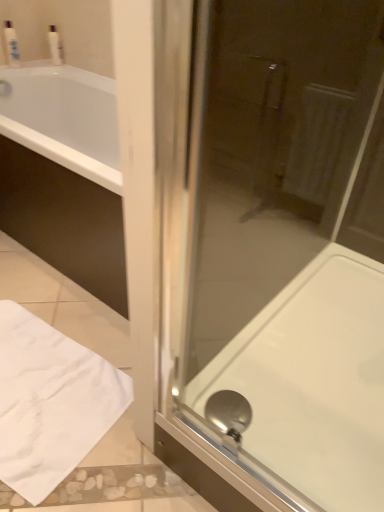
The height and width of the screenshot is (512, 384). What do you see at coordinates (273, 252) in the screenshot?
I see `transparent glass shower door at center` at bounding box center [273, 252].

What is the approximate height of white glossy bath at center?

It is 9.79 inches.

What is the approximate width of white plastic bottle at upper left, the first toiletry viewed from the left?

white plastic bottle at upper left, the first toiletry viewed from the left, is 2.85 inches wide.

I want to click on white plastic bottle at upper left, the first toiletry viewed from the left, so click(x=11, y=44).

At what (x,y) coordinates should I click in order to perform the action: click on white fabric towel at lower left. Please return your answer as a coordinate pair (x, y). The width and height of the screenshot is (384, 512). Looking at the image, I should click on (50, 402).

Is white plastic bottle at upper left, the first toiletry viewed from the left, wider or thinner than white glossy bath at center?

In the image, white plastic bottle at upper left, the first toiletry viewed from the left, appears to be more narrow than white glossy bath at center.

Can you tell me how much white plastic bottle at upper left, the first toiletry viewed from the left, and white glossy bath at center differ in facing direction?

white plastic bottle at upper left, the first toiletry viewed from the left, and white glossy bath at center are facing 90.8 degrees away from each other.

How distant is white plastic bottle at upper left, which appears as the second toiletry when viewed from the right, from white glossy bath at center?

A distance of 1.99 meters exists between white plastic bottle at upper left, which appears as the second toiletry when viewed from the right, and white glossy bath at center.

The width and height of the screenshot is (384, 512). I want to click on the 2nd toiletry counting from the left of the white glossy bath at center, so click(11, 44).

Consider the image. Is white fabric towel at lower left closer to the viewer compared to transparent glass shower door at center?

No, it is behind transparent glass shower door at center.

Is white fabric towel at lower left oriented away from transparent glass shower door at center?

No, white fabric towel at lower left's orientation is not away from transparent glass shower door at center.

From a real-world perspective, is white fabric towel at lower left below transparent glass shower door at center?

Yes, from a real-world perspective, white fabric towel at lower left is below transparent glass shower door at center.

From the image's perspective, relative to transparent glass shower door at center, is white fabric towel at lower left above or below?

white fabric towel at lower left is situated lower than transparent glass shower door at center in the image.

This screenshot has width=384, height=512. In order to click on sheet that appears on the right of white plastic bottle at upper left, which appears as the second toiletry when viewed from the right in this screenshot , I will do `click(50, 402)`.

From the image's perspective, is white plastic bottle at upper left, which appears as the second toiletry when viewed from the right, positioned above or below white fabric towel at lower left?

From the image's perspective, white plastic bottle at upper left, which appears as the second toiletry when viewed from the right, appears above white fabric towel at lower left.

Between white plastic bottle at upper left, which appears as the second toiletry when viewed from the right, and white fabric towel at lower left, which one has smaller size?

Smaller between the two is white plastic bottle at upper left, which appears as the second toiletry when viewed from the right.

In terms of height, does white fabric towel at lower left look taller or shorter compared to white glossy bath at center?

white fabric towel at lower left is shorter than white glossy bath at center.

Is white fabric towel at lower left oriented towards white glossy bath at center?

No, white fabric towel at lower left is not facing towards white glossy bath at center.

From the picture: How much distance is there between white fabric towel at lower left and white glossy bath at center?

white fabric towel at lower left is 20.99 inches from white glossy bath at center.

Is white fabric towel at lower left next to white glossy bath at center?

white fabric towel at lower left and white glossy bath at center are clearly separated.

In order to click on toiletry below the white plastic bottle at upper left, the first toiletry viewed from the left (from a real-world perspective) in this screenshot , I will do `click(55, 46)`.

Would you consider white plastic bottle at upper left, the first toiletry viewed from the left, to be distant from white glossy bottle at upper left, the first toiletry viewed from the right?

No, white plastic bottle at upper left, the first toiletry viewed from the left, is not far away from white glossy bottle at upper left, the first toiletry viewed from the right.

In terms of width, does white plastic bottle at upper left, the first toiletry viewed from the left, look wider or thinner when compared to white glossy bottle at upper left, the 2th toiletry positioned from the left?

Clearly, white plastic bottle at upper left, the first toiletry viewed from the left, has more width compared to white glossy bottle at upper left, the 2th toiletry positioned from the left.

Is transparent glass shower door at center to the left of white fabric towel at lower left from the viewer's perspective?

No.

From a real-world perspective, which is physically above, transparent glass shower door at center or white fabric towel at lower left?

In real-world perspective, transparent glass shower door at center is above.

Based on the photo, considering the relative sizes of transparent glass shower door at center and white fabric towel at lower left in the image provided, is transparent glass shower door at center smaller than white fabric towel at lower left?

Actually, transparent glass shower door at center might be larger than white fabric towel at lower left.

In the scene shown: From the image's perspective, is transparent glass shower door at center on top of white fabric towel at lower left?

Yes, from the image's perspective, transparent glass shower door at center is on top of white fabric towel at lower left.

Is point (209, 297) closer or farther from the camera than point (289, 326)?

Point (209, 297).

Does transparent glass shower door at center have a larger size compared to white glossy bath at center?

No, transparent glass shower door at center is not bigger than white glossy bath at center.

From the picture: From the image's perspective, which object appears higher, transparent glass shower door at center or white glossy bath at center?

transparent glass shower door at center, from the image's perspective.

From the picture: Is transparent glass shower door at center located outside white glossy bath at center?

That's correct, transparent glass shower door at center is outside of white glossy bath at center.

From a real-world perspective, which toiletry is the 2nd one above the white glossy bath at center? Please provide its 2D coordinates.

[(11, 44)]

This screenshot has width=384, height=512. In the image, there is a white fabric towel at lower left. Identify the location of screen door above it (from the image's perspective). (273, 252).

When comparing their distances from transparent glass shower door at center, does white glossy bottle at upper left, the 2th toiletry positioned from the left, or white plastic bottle at upper left, which appears as the second toiletry when viewed from the right, seem closer?

white glossy bottle at upper left, the 2th toiletry positioned from the left, lies closer to transparent glass shower door at center than the other object.

Based on their spatial positions, is white plastic bottle at upper left, which appears as the second toiletry when viewed from the right, or white glossy bottle at upper left, the first toiletry viewed from the right, further from white glossy bath at center?

white plastic bottle at upper left, which appears as the second toiletry when viewed from the right, lies further to white glossy bath at center than the other object.

Based on the photo, which object lies nearer to the anchor point white glossy bottle at upper left, the first toiletry viewed from the right, transparent glass shower door at center or white glossy bath at center?

transparent glass shower door at center is closer to white glossy bottle at upper left, the first toiletry viewed from the right.

Estimate the real-world distances between objects in this image. Which object is further from white plastic bottle at upper left, which appears as the second toiletry when viewed from the right, white fabric towel at lower left or white glossy bottle at upper left, the first toiletry viewed from the right?

white fabric towel at lower left.

From the image, which object appears to be farther from white fabric towel at lower left, white glossy bottle at upper left, the 2th toiletry positioned from the left, or white plastic bottle at upper left, the first toiletry viewed from the left?

The object further to white fabric towel at lower left is white glossy bottle at upper left, the 2th toiletry positioned from the left.

Considering their positions, is white plastic bottle at upper left, the first toiletry viewed from the left, positioned further to white fabric towel at lower left than white glossy bath at center?

white plastic bottle at upper left, the first toiletry viewed from the left, is further to white fabric towel at lower left.

Which object lies nearer to the anchor point white fabric towel at lower left, white glossy bath at center or white glossy bottle at upper left, the first toiletry viewed from the right?

Based on the image, white glossy bath at center appears to be nearer to white fabric towel at lower left.

Based on their spatial positions, is white glossy bath at center or white glossy bottle at upper left, the 2th toiletry positioned from the left, further from white plastic bottle at upper left, the first toiletry viewed from the left?

white glossy bath at center.

Where is `bath between transparent glass shower door at center and white glossy bottle at upper left, the first toiletry viewed from the right, from front to back`? bath between transparent glass shower door at center and white glossy bottle at upper left, the first toiletry viewed from the right, from front to back is located at coordinates (314, 379).

Where is `toiletry between white glossy bottle at upper left, the first toiletry viewed from the right, and white fabric towel at lower left vertically`? toiletry between white glossy bottle at upper left, the first toiletry viewed from the right, and white fabric towel at lower left vertically is located at coordinates (11, 44).

Find the location of a particular element. screen door between white fabric towel at lower left and white glossy bath at center from left to right is located at coordinates (273, 252).

Image resolution: width=384 pixels, height=512 pixels. I want to click on toiletry between white glossy bottle at upper left, the first toiletry viewed from the right, and white glossy bath at center vertically, so click(x=11, y=44).